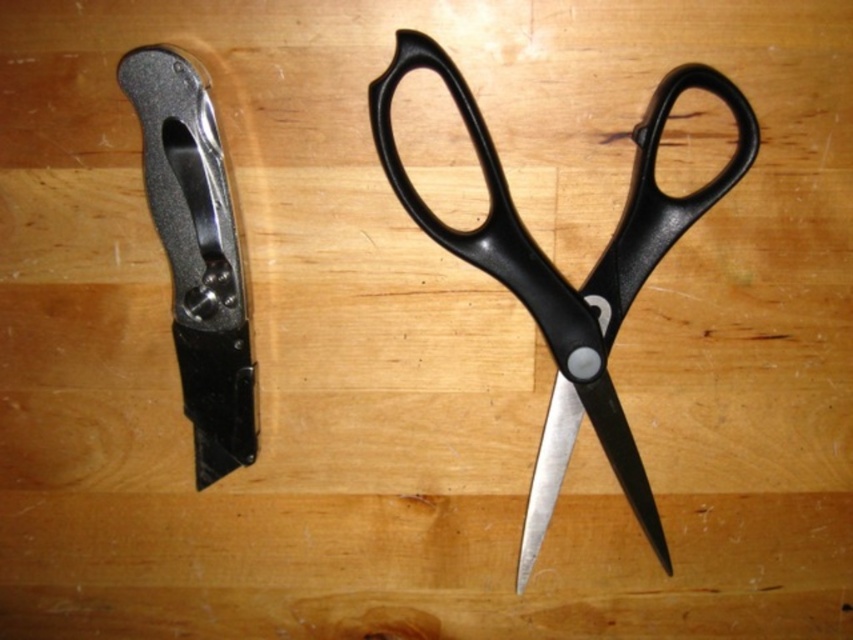
Is brushed metal utility knife at upper left thinner than silver metallic blade at center?

In fact, brushed metal utility knife at upper left might be wider than silver metallic blade at center.

This screenshot has width=853, height=640. Describe the element at coordinates (196, 253) in the screenshot. I see `brushed metal utility knife at upper left` at that location.

Locate an element on the screen. This screenshot has width=853, height=640. brushed metal utility knife at upper left is located at coordinates (196, 253).

Is black plastic scissors at center wider than silver metallic blade at center?

Yes, black plastic scissors at center is wider than silver metallic blade at center.

This screenshot has height=640, width=853. Find the location of `black plastic scissors at center`. black plastic scissors at center is located at coordinates (561, 276).

The height and width of the screenshot is (640, 853). In order to click on black plastic scissors at center in this screenshot , I will do `click(561, 276)`.

Between black plastic scissors at center and brushed metal utility knife at upper left, which one appears on the left side from the viewer's perspective?

brushed metal utility knife at upper left is more to the left.

Can you confirm if black plastic scissors at center is smaller than brushed metal utility knife at upper left?

Actually, black plastic scissors at center might be larger than brushed metal utility knife at upper left.

Which is behind, point (550, 440) or point (252, 376)?

Positioned behind is point (550, 440).

The height and width of the screenshot is (640, 853). Find the location of `black plastic scissors at center`. black plastic scissors at center is located at coordinates (561, 276).